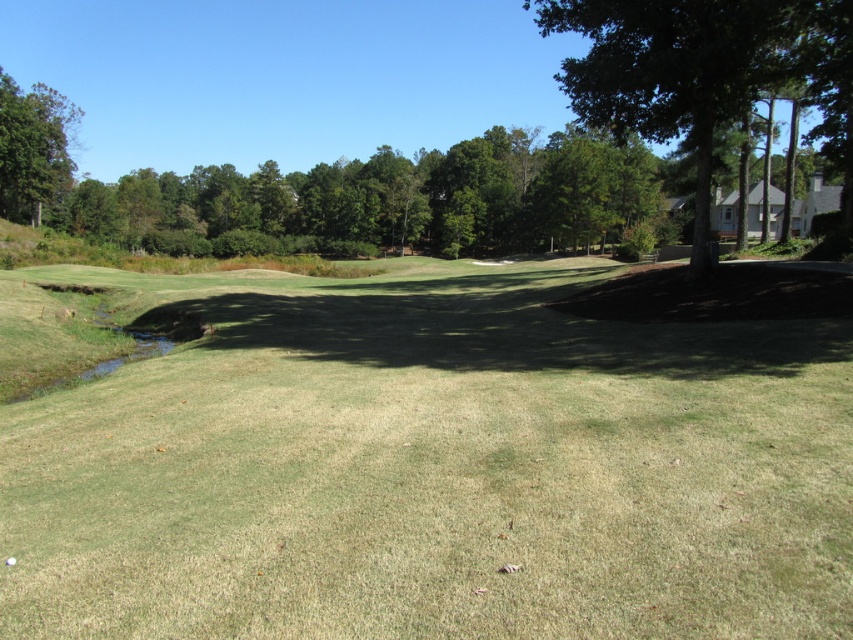
Question: Which point is closer to the camera taking this photo?

Choices:
 (A) (173, 600)
 (B) (708, 161)
 (C) (30, 152)

Answer: (A)

Question: Is green grass at center thinner than green leafy tree at upper left?

Choices:
 (A) no
 (B) yes

Answer: (A)

Question: Which point is farther to the camera?

Choices:
 (A) green leafy tree at upper right
 (B) green leafy tree at upper left

Answer: (B)

Question: Estimate the real-world distances between objects in this image. Which object is closer to the green leafy tree at upper left?

Choices:
 (A) green leafy tree at upper right
 (B) green grass at center

Answer: (B)

Question: From the image, what is the correct spatial relationship of green grass at center in relation to green leafy tree at upper right?

Choices:
 (A) right
 (B) left

Answer: (B)

Question: Does green grass at center appear on the left side of green leafy tree at upper left?

Choices:
 (A) yes
 (B) no

Answer: (B)